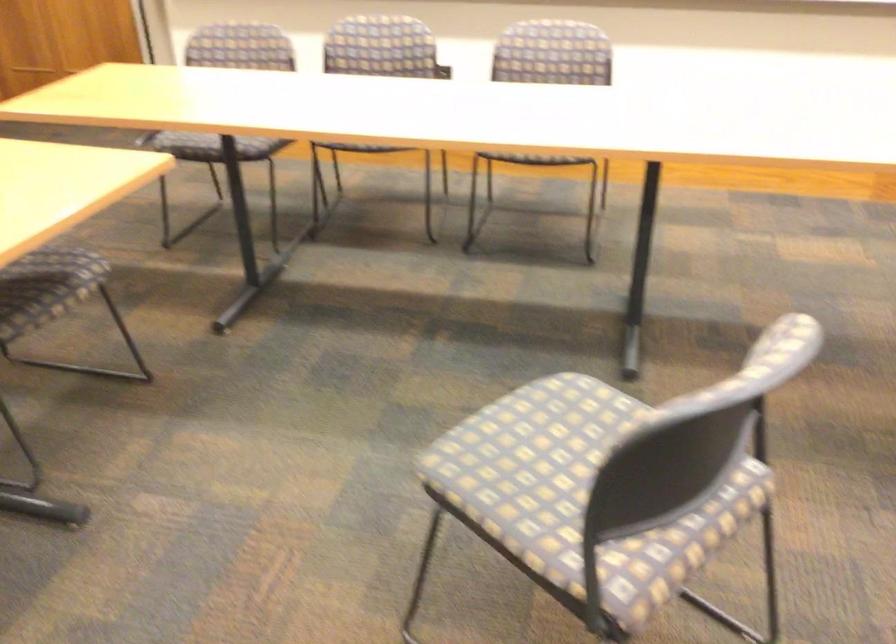
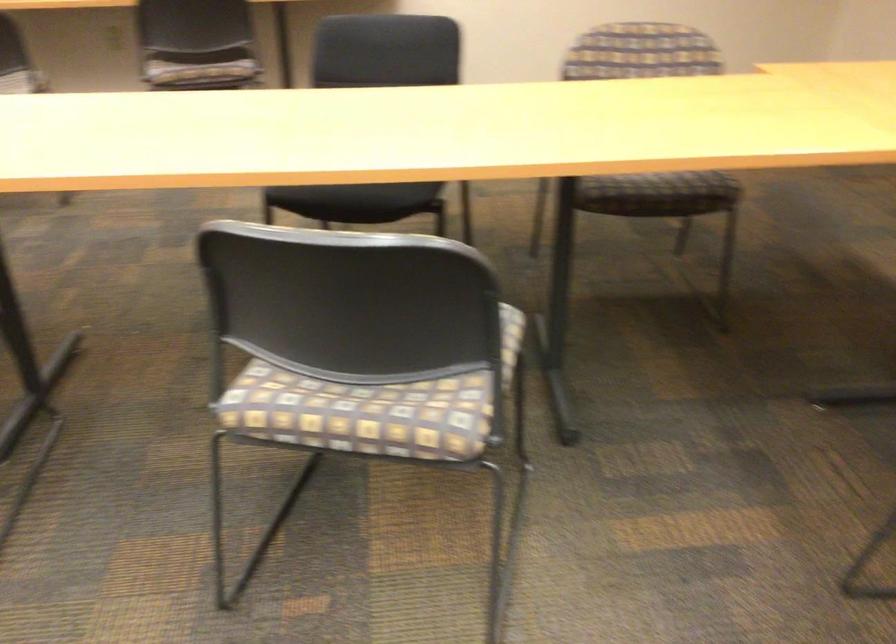
The images are taken continuously from a first-person perspective. In which direction is your viewpoint rotating?

The rotation direction of the camera is right-down.